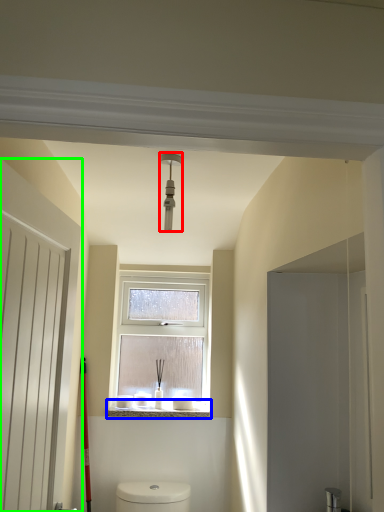
Question: Estimate the real-world distances between objects in this image. Which object is closer to light fixture (highlighted by a red box), window sill (highlighted by a blue box) or door (highlighted by a green box)?

Choices:
 (A) window sill
 (B) door

Answer: (B)